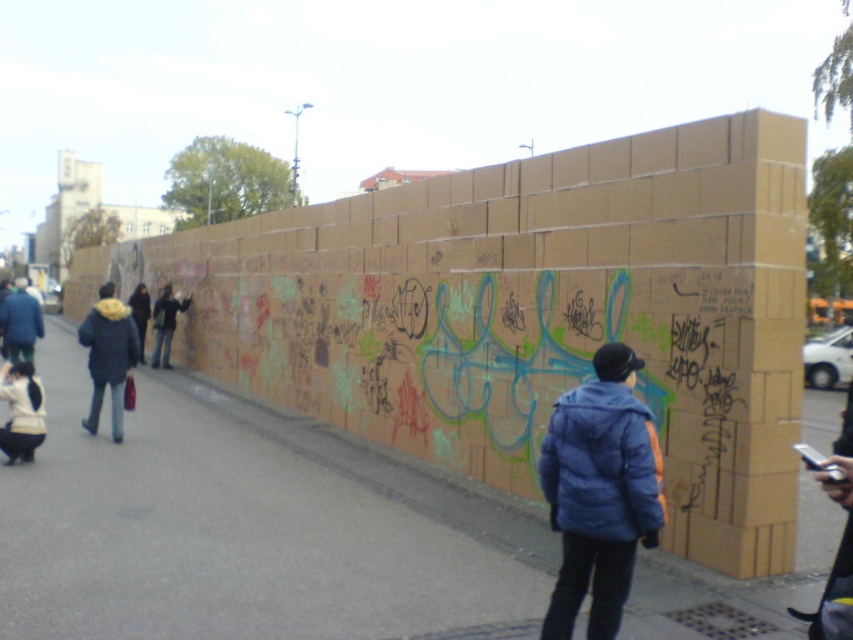
Question: Is brown cardboard wall at center below blue down jacket at center?

Choices:
 (A) no
 (B) yes

Answer: (B)

Question: Among these objects, which one is nearest to the camera?

Choices:
 (A) dark blue jacket at center
 (B) matte blue jacket at left
 (C) blue down jacket at center
 (D) denim jacket at left

Answer: (C)

Question: Estimate the real-world distances between objects in this image. Which object is farther from the dark blue puffy jacket at center?

Choices:
 (A) white fleece jacket at lower left
 (B) brown cardboard wall at center
 (C) denim jacket at left

Answer: (A)

Question: From the image, what is the correct spatial relationship of matte blue jacket at left in relation to dark blue puffy jacket at center?

Choices:
 (A) below
 (B) above

Answer: (A)

Question: Can you confirm if blue down jacket at center is smaller than dark blue puffy jacket at center?

Choices:
 (A) no
 (B) yes

Answer: (B)

Question: Which of the following is the farthest from the observer?

Choices:
 (A) matte blue jacket at left
 (B) dark blue puffy jacket at center
 (C) white fleece jacket at lower left

Answer: (B)